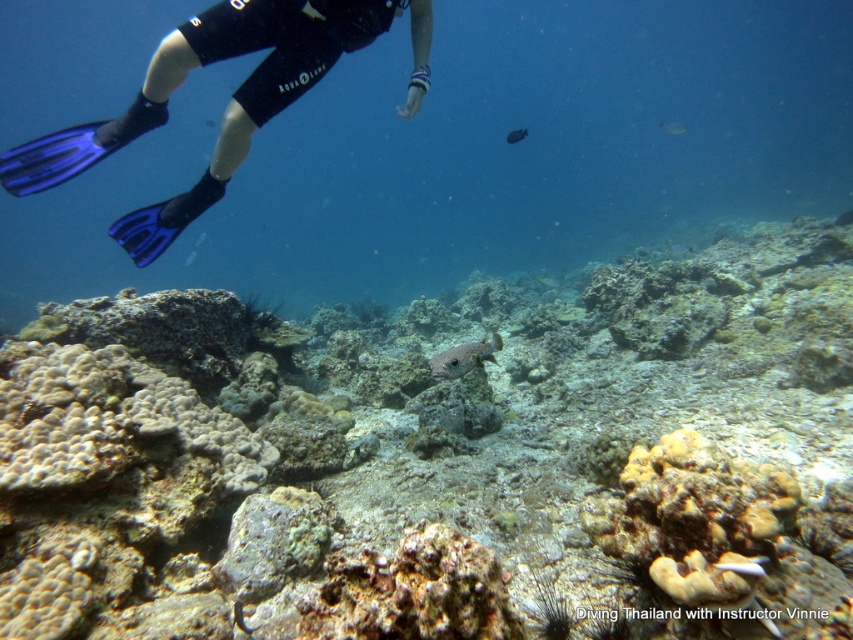
Question: Considering the real-world distances, which object is closest to the white matte fish at center?

Choices:
 (A) silvery metallic fish at center
 (B) rough textured coral reef at center

Answer: (B)

Question: Among these points, which one is farthest from the camera?

Choices:
 (A) click(451, 369)
 (B) click(751, 560)
 (C) click(519, 132)

Answer: (C)

Question: Can you confirm if rough textured coral reef at center is bigger than white matte fish at center?

Choices:
 (A) yes
 (B) no

Answer: (A)

Question: Can you confirm if rough textured coral reef at center is positioned above translucent blue fish at center?

Choices:
 (A) yes
 (B) no

Answer: (B)

Question: Which point is farther from the camera taking this photo?

Choices:
 (A) (511, 138)
 (B) (213, 458)
 (C) (670, 128)

Answer: (C)

Question: Is rough textured coral reef at center to the left of speckled gray fish at center from the viewer's perspective?

Choices:
 (A) yes
 (B) no

Answer: (B)